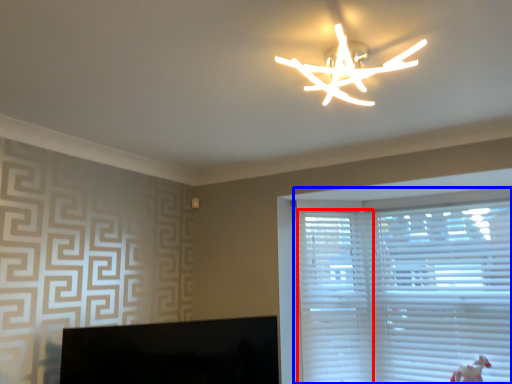
Question: Which object is closer to the camera taking this photo, blind (highlighted by a red box) or window blind (highlighted by a blue box)?

Choices:
 (A) blind
 (B) window blind

Answer: (B)